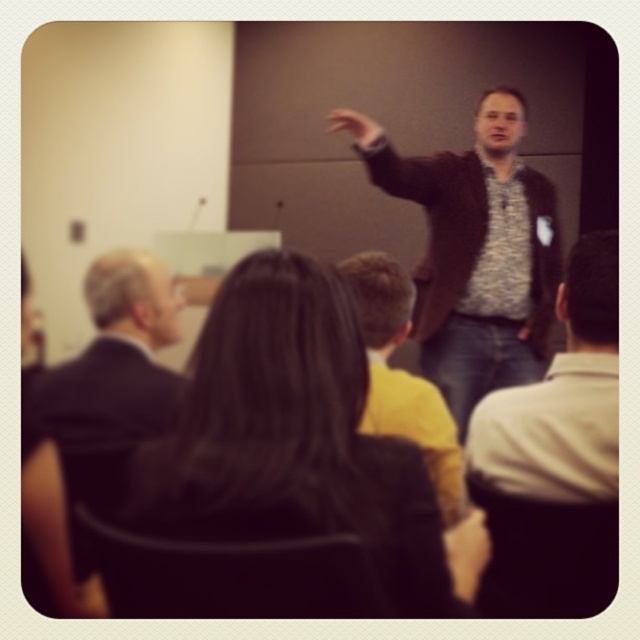
You are an attendee at the presentation and want to identify the speaker based on their clothing. The speaker is standing on the right side of the frame. Which of the two shirts, the patterned fabric shirt at center or the yellow shirt at center, is the speaker wearing?

The speaker is wearing the patterned fabric shirt at center because it is smaller than the yellow shirt at center, and the description states the speaker is on the right side of the frame.

You are an attendee at this presentation and want to identify the speaker. The speaker is the person wearing the yellow shirt at center. However, you notice another person wearing the patterned fabric shirt at center. Which shirt is shorter in length?

The patterned fabric shirt at center is shorter than the yellow shirt at center.

In the scene shown: You are an attendee at this presentation. You need to locate the black suit at left. Where exactly is it positioned in the room?

The black suit at left is located at point 0.589 on the x axis and 0.178 on the y axis.